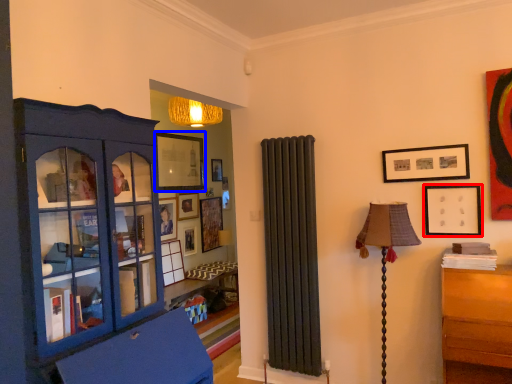
Question: Which object is further to the camera taking this photo, picture frame (highlighted by a red box) or picture frame (highlighted by a blue box)?

Choices:
 (A) picture frame
 (B) picture frame

Answer: (B)